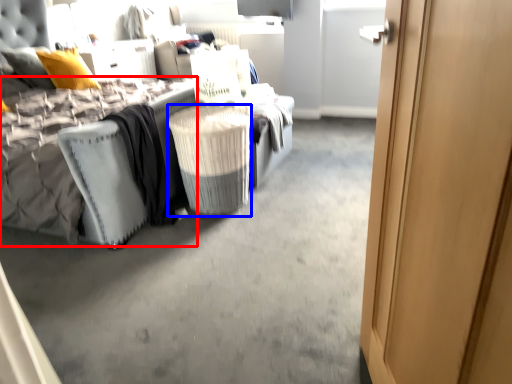
Question: Among these objects, which one is farthest to the camera, mattress (highlighted by a red box) or laundry basket (highlighted by a blue box)?

Choices:
 (A) mattress
 (B) laundry basket

Answer: (B)